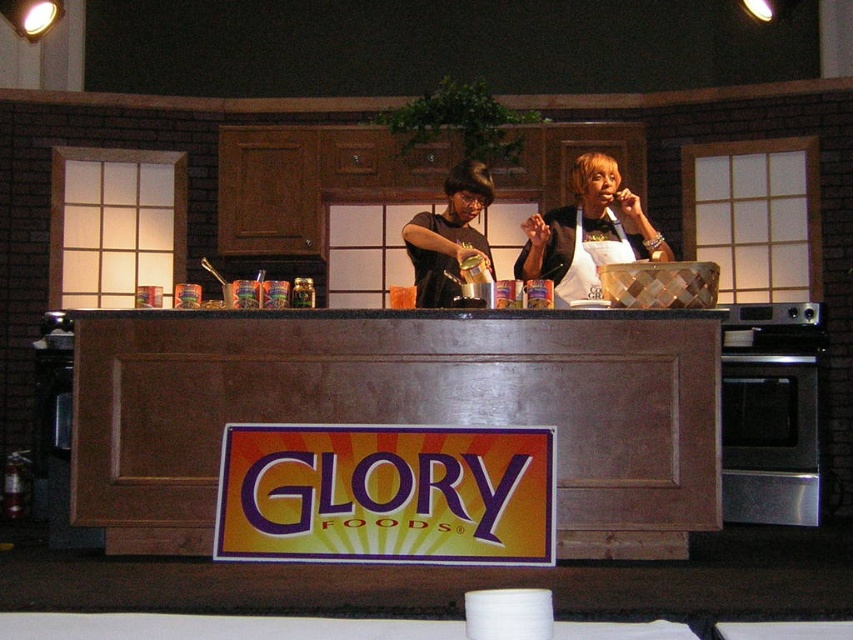
Question: Estimate the real-world distances between objects in this image. Which object is closer to the white fabric apron at center?

Choices:
 (A) brown wood counter at center
 (B) white apron at center
 (C) yellowmattesign at center
 (D) matte black apron at center

Answer: (B)

Question: Does brown wood counter at center have a greater width compared to white fabric apron at center?

Choices:
 (A) no
 (B) yes

Answer: (B)

Question: Among these points, which one is nearest to the camera?

Choices:
 (A) (462, 250)
 (B) (253, 472)

Answer: (B)

Question: Considering the relative positions of yellowmattesign at center and white apron at center in the image provided, where is yellowmattesign at center located with respect to white apron at center?

Choices:
 (A) above
 (B) below

Answer: (B)

Question: Can you confirm if brown wood counter at center is positioned to the left of yellowmattesign at center?

Choices:
 (A) yes
 (B) no

Answer: (B)

Question: Which of the following is the closest to the observer?

Choices:
 (A) (248, 488)
 (B) (666, 246)
 (C) (248, 323)

Answer: (A)